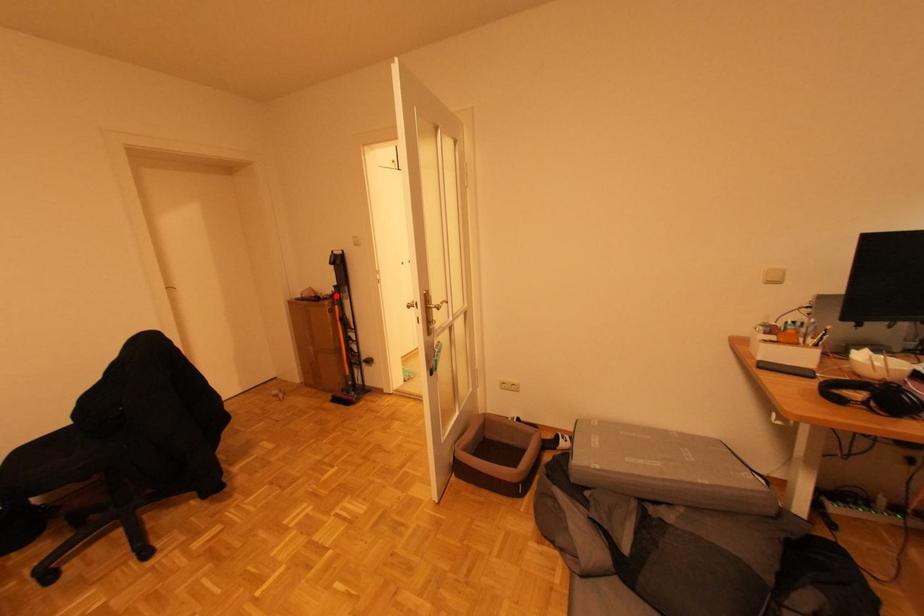
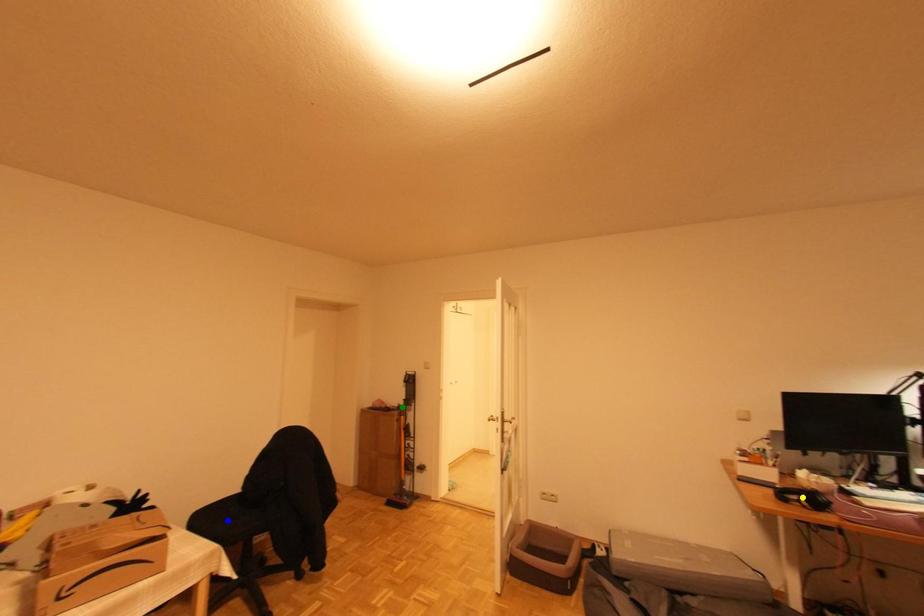
Question: I am providing you with two images of the same scene from different viewpoints. A red point is marked on the first image. You are given multiple points on the second image. In image 2, which mark is for the same physical point as the one in image 1?

Choices:
 (A) yellow point
 (B) blue point
 (C) green point

Answer: (C)